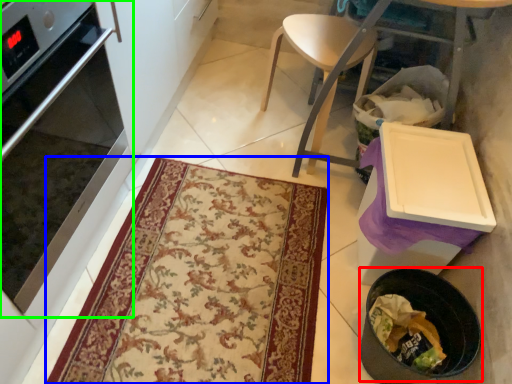
Question: Estimate the real-world distances between objects in this image. Which object is farther from appliance (highlighted by a red box), mat (highlighted by a blue box) or oven (highlighted by a green box)?

Choices:
 (A) mat
 (B) oven

Answer: (B)